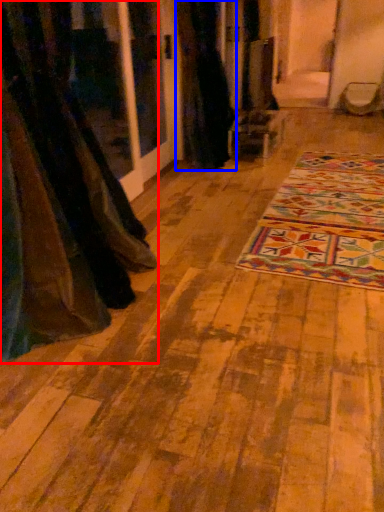
Question: Which object appears farthest to the camera in this image, curtain (highlighted by a red box) or curtain (highlighted by a blue box)?

Choices:
 (A) curtain
 (B) curtain

Answer: (B)